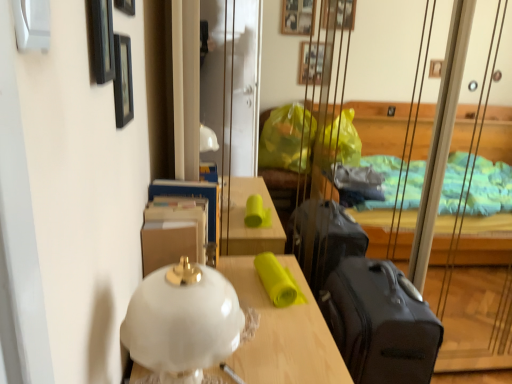
Question: Is white glass lamp at center completely or partially outside of black smooth suitcase at right?

Choices:
 (A) no
 (B) yes

Answer: (B)

Question: Is white glass lamp at center beside black smooth suitcase at right?

Choices:
 (A) no
 (B) yes

Answer: (A)

Question: From a real-world perspective, is white glass lamp at center positioned under black smooth suitcase at right based on gravity?

Choices:
 (A) yes
 (B) no

Answer: (B)

Question: Is black smooth suitcase at right located within white glass lamp at center?

Choices:
 (A) no
 (B) yes

Answer: (A)

Question: Can you confirm if white glass lamp at center is positioned to the left of black smooth suitcase at right?

Choices:
 (A) no
 (B) yes

Answer: (B)

Question: Considering the relative sizes of white glass lamp at center and black smooth suitcase at right in the image provided, is white glass lamp at center bigger than black smooth suitcase at right?

Choices:
 (A) yes
 (B) no

Answer: (B)

Question: Is black matte picture frame at upper left, positioned as the third picture frame in front-to-back order, shorter than black matte picture frame at upper left, positioned as the 3th picture frame in back-to-front order?

Choices:
 (A) yes
 (B) no

Answer: (A)

Question: Considering the relative positions of black matte picture frame at upper left, positioned as the third picture frame in front-to-back order, and black matte picture frame at upper left, which appears as the first picture frame when viewed from the front, in the image provided, is black matte picture frame at upper left, positioned as the third picture frame in front-to-back order, to the right of black matte picture frame at upper left, which appears as the first picture frame when viewed from the front, from the viewer's perspective?

Choices:
 (A) yes
 (B) no

Answer: (B)

Question: Considering the relative positions of black matte picture frame at upper left, positioned as the third picture frame in front-to-back order, and black matte picture frame at upper left, positioned as the 3th picture frame in back-to-front order, in the image provided, is black matte picture frame at upper left, positioned as the third picture frame in front-to-back order, to the left of black matte picture frame at upper left, positioned as the 3th picture frame in back-to-front order, from the viewer's perspective?

Choices:
 (A) no
 (B) yes

Answer: (B)

Question: Is black matte picture frame at upper left, positioned as the third picture frame in front-to-back order, facing away from black matte picture frame at upper left, which appears as the first picture frame when viewed from the front?

Choices:
 (A) yes
 (B) no

Answer: (B)

Question: From a real-world perspective, is black matte picture frame at upper left, which is counted as the first picture frame, starting from the back, on top of black matte picture frame at upper left, positioned as the 3th picture frame in back-to-front order?

Choices:
 (A) yes
 (B) no

Answer: (B)

Question: Is black matte picture frame at upper left, which is counted as the first picture frame, starting from the back, not near black matte picture frame at upper left, which appears as the first picture frame when viewed from the front?

Choices:
 (A) no
 (B) yes

Answer: (A)

Question: Is white matte lampshade at center taller than black smooth suitcase at right?

Choices:
 (A) no
 (B) yes

Answer: (A)